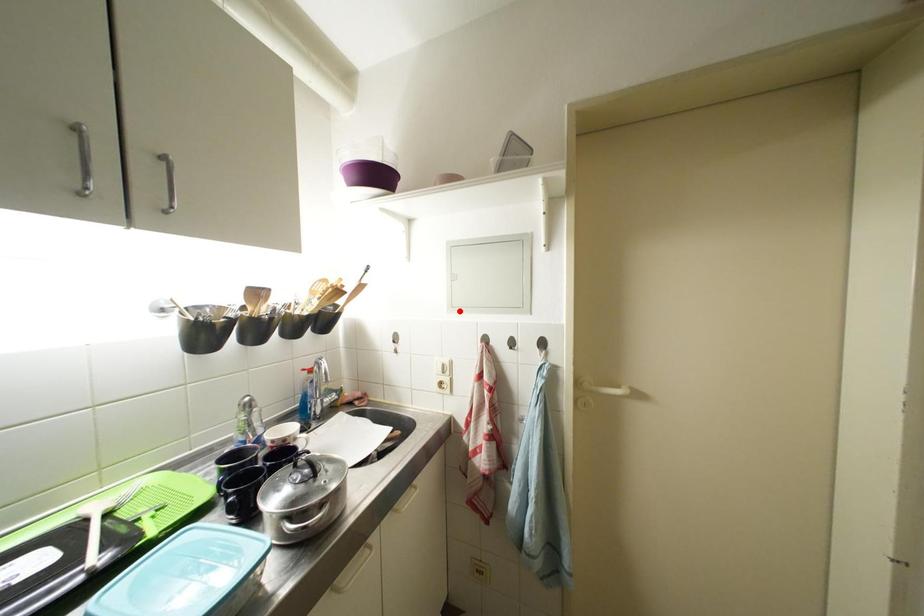
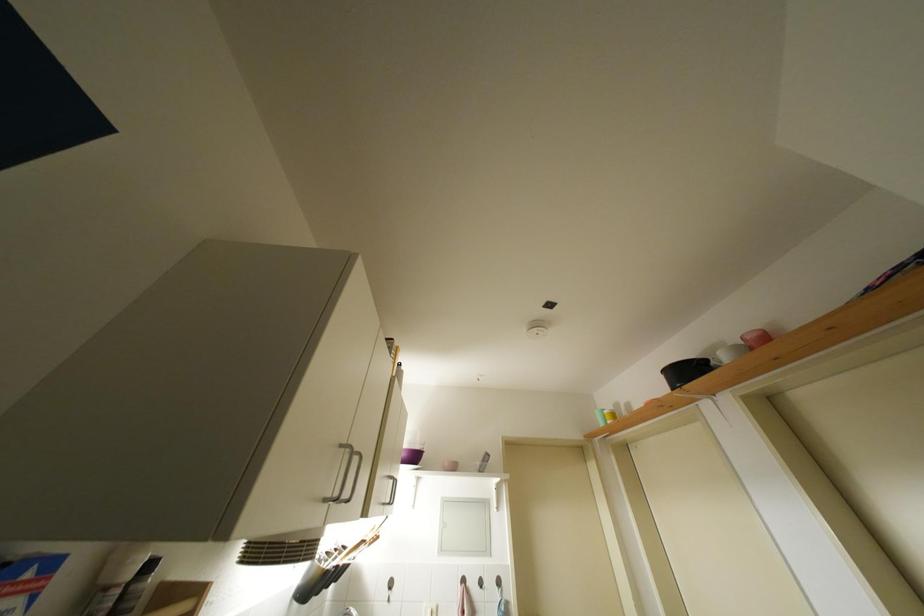
Locate, in the second image, the point that corresponds to the highlighted location in the first image.

(447, 554)